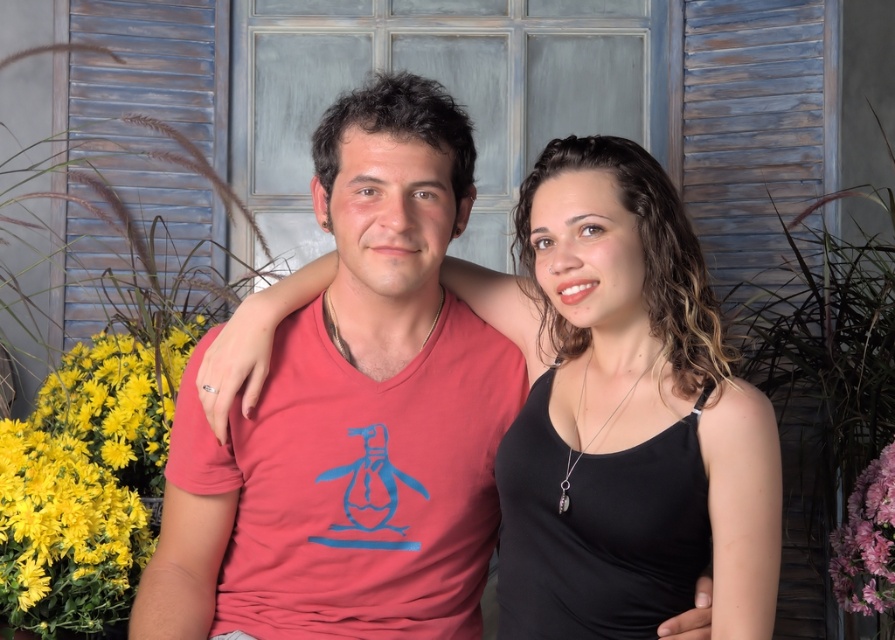
Question: Which point is farther to the camera?

Choices:
 (A) (354, 314)
 (B) (224, 268)

Answer: (B)

Question: Is black matte tank top at center bigger than yellow matte flower at left?

Choices:
 (A) no
 (B) yes

Answer: (A)

Question: Which is nearer to the yellow matte flower at left?

Choices:
 (A) matte red t-shirt at center
 (B) metallic blue shutter at upper left
 (C) pink matte flower at right
 (D) black matte tank top at center

Answer: (A)

Question: Does yellow matte flower at left appear over metallic blue shutter at upper left?

Choices:
 (A) yes
 (B) no

Answer: (B)

Question: Based on their relative distances, which object is farther from the yellow matte flower at left?

Choices:
 (A) metallic blue shutter at upper left
 (B) pink matte flower at right

Answer: (B)

Question: From the image, what is the correct spatial relationship of black matte tank top at center in relation to metallic blue shutter at upper left?

Choices:
 (A) left
 (B) right

Answer: (B)